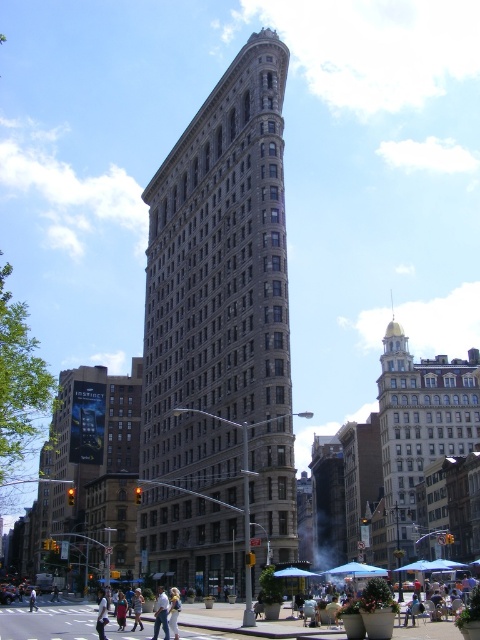
You are standing at the point marked as point (232, 451) in the image. There is a coffee shop 72.43 meters away from you. Which direction should you walk to reach the coffee shop?

Since the coffee shop is 72.43 meters away from point (232, 451), you should walk towards the direction where the distance decreases to reach it.

You are standing at the intersection of 23rd Street and Fifth Avenue in New York City. You want to locate the brown stone building at center. According to the coordinates provided, where should you look relative to your current position?

The brown stone building at center is located at coordinates point [217,278], which corresponds to the central area of the image. Since you are at the intersection, you should look straight ahead towards the center of the image to find the building.

In the scene shown: You are standing at the point marked as point (217, 278) in the image. Which building are you facing?

You are facing the brown stone building at center located at point (217, 278).